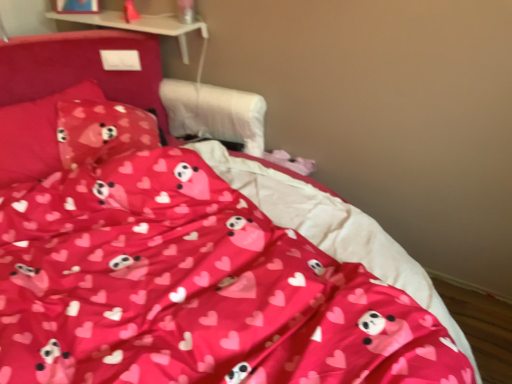
Question: Considering the relative sizes of pink fabric pillow at upper left, which appears as the first pillow when viewed from the left, and matte pink fabric pillow at upper left, which is the first pillow from right to left, in the image provided, is pink fabric pillow at upper left, which appears as the first pillow when viewed from the left, bigger than matte pink fabric pillow at upper left, which is the first pillow from right to left,?

Choices:
 (A) yes
 (B) no

Answer: (A)

Question: Is pink fabric pillow at upper left, which is the second pillow in right-to-left order, placed right next to matte pink fabric pillow at upper left, marked as the second pillow in a left-to-right arrangement?

Choices:
 (A) no
 (B) yes

Answer: (A)

Question: Would you say matte pink fabric pillow at upper left, marked as the second pillow in a left-to-right arrangement, is part of pink fabric pillow at upper left, which appears as the first pillow when viewed from the left,'s contents?

Choices:
 (A) yes
 (B) no

Answer: (A)

Question: Is pink fabric pillow at upper left, which appears as the first pillow when viewed from the left, closer to camera compared to matte pink fabric pillow at upper left, which is the first pillow from right to left?

Choices:
 (A) no
 (B) yes

Answer: (B)

Question: Is pink fabric pillow at upper left, which is the second pillow in right-to-left order, not within matte pink fabric pillow at upper left, marked as the second pillow in a left-to-right arrangement?

Choices:
 (A) yes
 (B) no

Answer: (A)

Question: From a real-world perspective, is pink fabric pillow at upper left, which appears as the first pillow when viewed from the left, located beneath matte pink fabric pillow at upper left, which is the first pillow from right to left?

Choices:
 (A) no
 (B) yes

Answer: (A)

Question: Can you confirm if matte pink fabric pillow at upper left, which is the first pillow from right to left, is wider than pink fabric pillow at upper left, which is the second pillow in right-to-left order?

Choices:
 (A) no
 (B) yes

Answer: (A)

Question: Does matte pink fabric pillow at upper left, marked as the second pillow in a left-to-right arrangement, appear on the right side of pink fabric pillow at upper left, which is the second pillow in right-to-left order?

Choices:
 (A) yes
 (B) no

Answer: (A)

Question: Is matte pink fabric pillow at upper left, marked as the second pillow in a left-to-right arrangement, aimed at pink fabric pillow at upper left, which is the second pillow in right-to-left order?

Choices:
 (A) no
 (B) yes

Answer: (B)

Question: Is pink fabric pillow at upper left, which is the second pillow in right-to-left order, surrounded by matte pink fabric pillow at upper left, which is the first pillow from right to left?

Choices:
 (A) no
 (B) yes

Answer: (A)

Question: From a real-world perspective, does matte pink fabric pillow at upper left, marked as the second pillow in a left-to-right arrangement, stand above pink fabric pillow at upper left, which appears as the first pillow when viewed from the left?

Choices:
 (A) no
 (B) yes

Answer: (A)

Question: Are matte pink fabric pillow at upper left, marked as the second pillow in a left-to-right arrangement, and pink fabric pillow at upper left, which appears as the first pillow when viewed from the left, far apart?

Choices:
 (A) no
 (B) yes

Answer: (A)

Question: Considering their positions, is matte pink fabric pillow at upper left, which is the first pillow from right to left, located in front of or behind pink fabric pillow at upper left, which is the second pillow in right-to-left order?

Choices:
 (A) behind
 (B) front

Answer: (A)